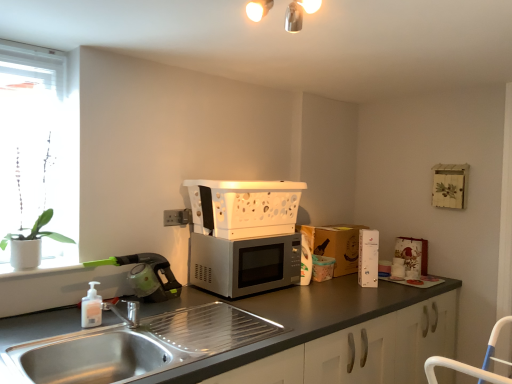
Find the location of a particular element. This screenshot has height=384, width=512. unoccupied space behind white cardboard box at right, the first appliance positioned from the right is located at coordinates (354, 275).